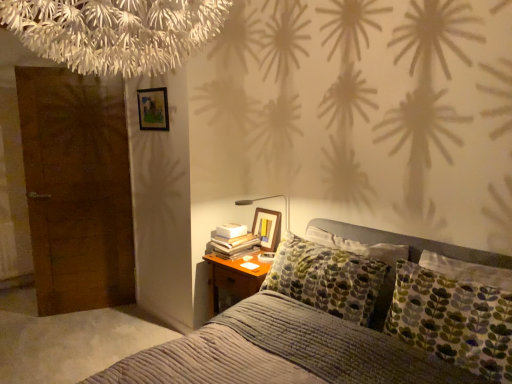
You are a GUI agent. You are given a task and a screenshot of the screen. Output one action in this format:
    pyautogui.click(x=<x>, y=<y>)
    Task: Click on the vacant area on top of white paper book at bedside (from a real-world perspective)
    
    Given the screenshot: What is the action you would take?
    pyautogui.click(x=229, y=236)